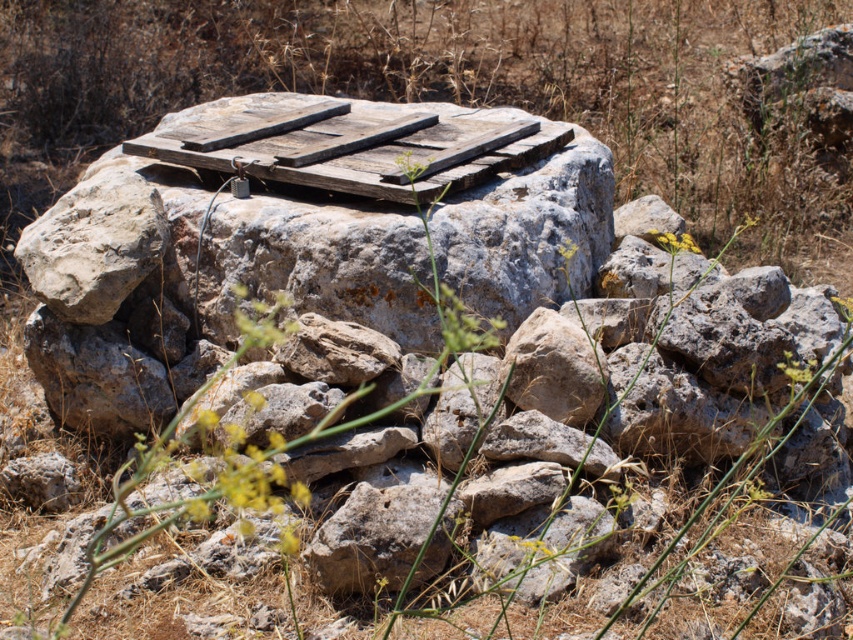
You are a hiker who needs to place a small backpack on the weathered wood at center and the weathered wood pallet at center. Which surface can accommodate the backpack without it falling off due to height differences?

The weathered wood at center has a greater height compared to the weathered wood pallet at center, so placing the backpack on the taller weathered wood at center would be more stable and less likely to fall off due to the height difference.

You are standing in front of the stone structure and see two objects labeled weathered wood at center and weathered wood pallet at center. Which one is located to the right?

The weathered wood at center is positioned on the right side of the weathered wood pallet at center, so the weathered wood at center is to the right.

You are standing in front of the stone structure and want to place a small flag at two specific points marked as point 1 and point 2. If point 1 is at coordinates point (x=154, y=156) and point 2 is at point (x=317, y=106), which point is closer to you?

Point (x=154, y=156) is closer to the viewer than point (x=317, y=106).